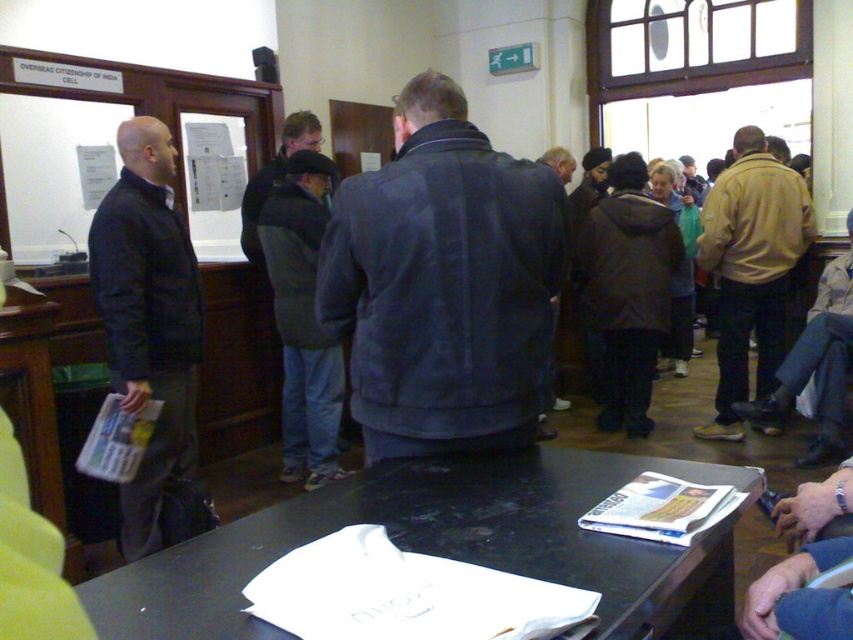
Question: Can you confirm if dark blue leather jacket at center is positioned above brown leather jacket at center?

Choices:
 (A) no
 (B) yes

Answer: (B)

Question: Which object is farther from the camera taking this photo?

Choices:
 (A) dark blue jacket at left
 (B) dark blue leather jacket at center
 (C) brown leather jacket at center

Answer: (C)

Question: Which object is the farthest from the brown leather jacket at center?

Choices:
 (A) white paper at center
 (B) dark blue leather jacket at center

Answer: (A)

Question: Which of the following is the closest to the observer?

Choices:
 (A) dark blue jacket at left
 (B) white paper at center
 (C) beige suede jacket at right
 (D) dark gray jacket at center

Answer: (B)

Question: Is dark blue jacket at left to the left of brown leather jacket at center from the viewer's perspective?

Choices:
 (A) yes
 (B) no

Answer: (A)

Question: Does dark blue leather jacket at center have a greater width compared to brown leather jacket at center?

Choices:
 (A) no
 (B) yes

Answer: (A)